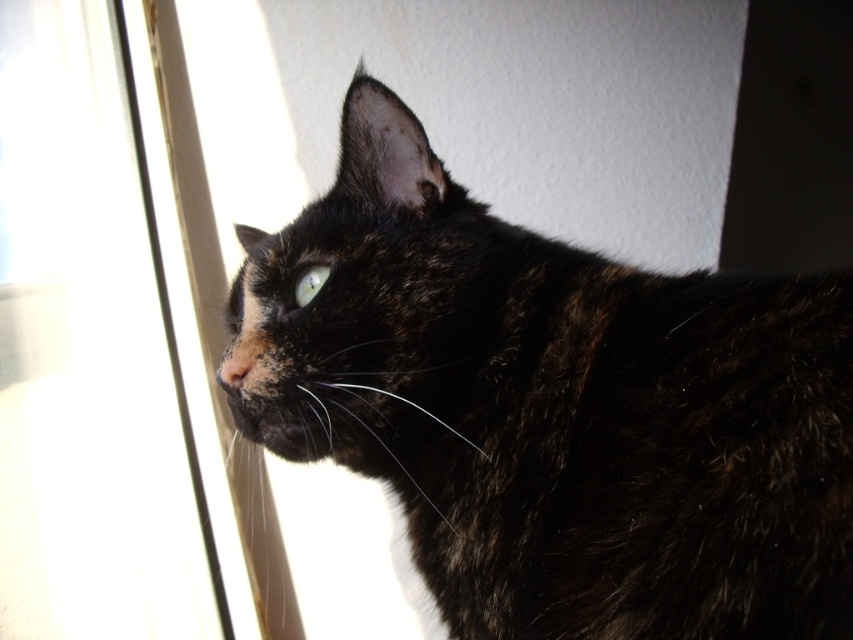
Which is below, transparent glass window at left or shiny green eye at upper center?

transparent glass window at left

The height and width of the screenshot is (640, 853). Describe the element at coordinates (85, 355) in the screenshot. I see `transparent glass window at left` at that location.

At what (x,y) coordinates should I click in order to perform the action: click on transparent glass window at left. Please return your answer as a coordinate pair (x, y). The width and height of the screenshot is (853, 640). Looking at the image, I should click on (85, 355).

Between point (515, 467) and point (316, 269), which one is positioned behind?

Positioned behind is point (316, 269).

Which is behind, point (357, 420) or point (291, 304)?

The point (291, 304) is behind.

At what (x,y) coordinates should I click in order to perform the action: click on tortoiseshell fur cat at upper left. Please return your answer as a coordinate pair (x, y). Looking at the image, I should click on (554, 406).

Who is positioned more to the left, tortoiseshell fur cat at upper left or transparent glass window at left?

From the viewer's perspective, transparent glass window at left appears more on the left side.

Measure the distance between tortoiseshell fur cat at upper left and transparent glass window at left.

tortoiseshell fur cat at upper left and transparent glass window at left are 25.07 inches apart.

Does point (363, 257) come in front of point (100, 483)?

Yes.

Image resolution: width=853 pixels, height=640 pixels. I want to click on tortoiseshell fur cat at upper left, so click(x=554, y=406).